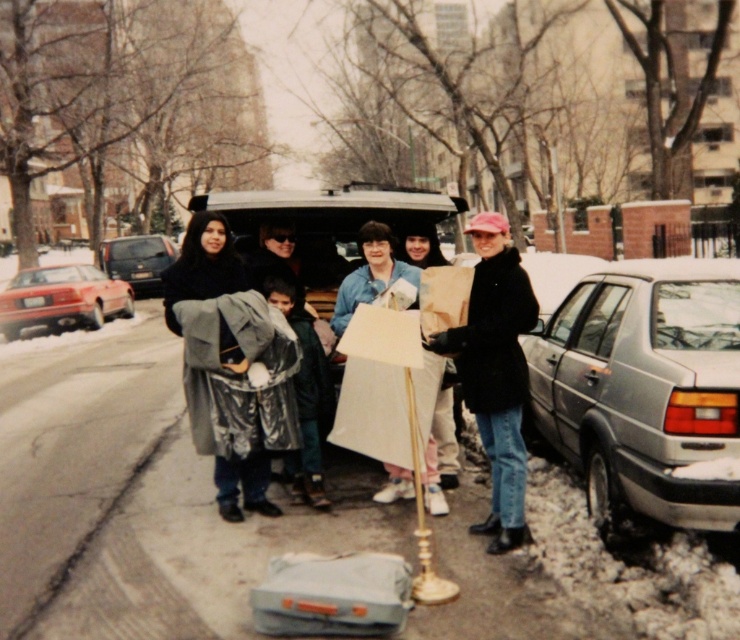
You are standing at the point with coordinates point (192, 291) and want to walk towards the point with coordinates point (246, 390). Which direction should you face to move towards it?

You should face forward because point (246, 390) is in front of point (192, 291).

You are a photographer standing in front of the dark gray wool coat at center and the dark gray matte van at center. Which object is nearer to you?

The dark gray wool coat at center is closer to the viewer than the dark gray matte van at center.

Consider the image. You are a photographer standing 3 meters away from the dark gray wool coat at center. You want to take a photo of the camera that is 5.27 meters away from the coat. Can you adjust your position so that you are exactly 2.27 meters away from the camera?

The distance between the dark gray wool coat at center and the camera is 5.27 meters. If you are currently 3 meters away from the coat, moving towards the camera would reduce your distance to it. To be 2.27 meters from the camera, you need to be 3 meters minus 2.27 meters equals 0.73 meters away from the coat. However, since the coat and camera are 5.27 meters apart, this isn not possible. Therefore, you cannot adjust your position to be exactly 2.27 meters from the camera while maintaining the given setup.